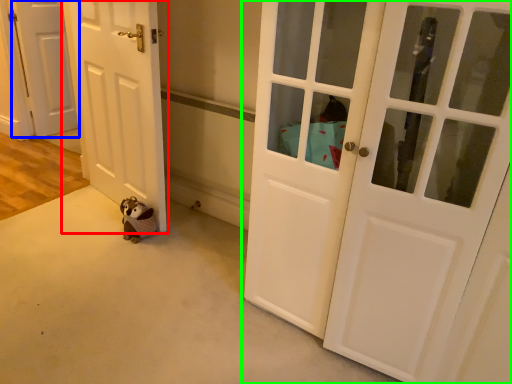
Question: Considering the real-world distances, which object is closest to door (highlighted by a red box)? door (highlighted by a blue box) or door (highlighted by a green box).

Choices:
 (A) door
 (B) door

Answer: (B)